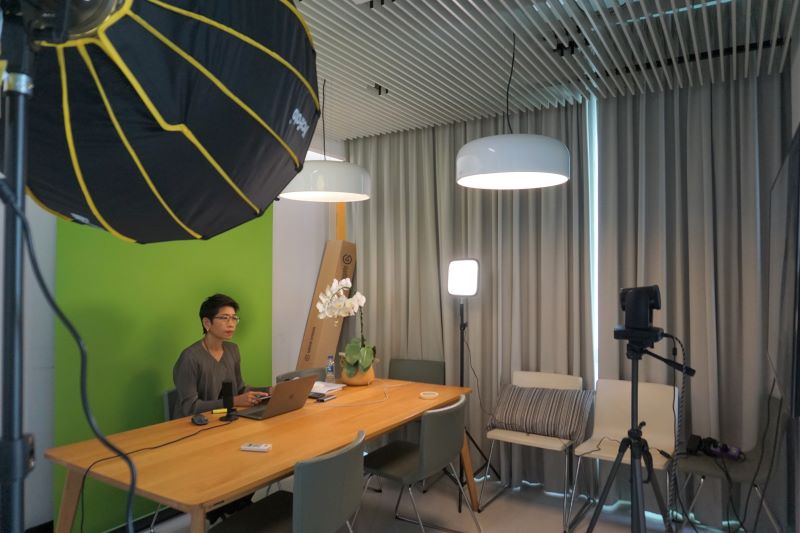
At what (x,y) coordinates should I click in order to perform the action: click on chairs. Please return your answer as a coordinate pair (x, y). Looking at the image, I should click on (609, 446), (522, 414), (422, 448), (304, 497), (418, 366).